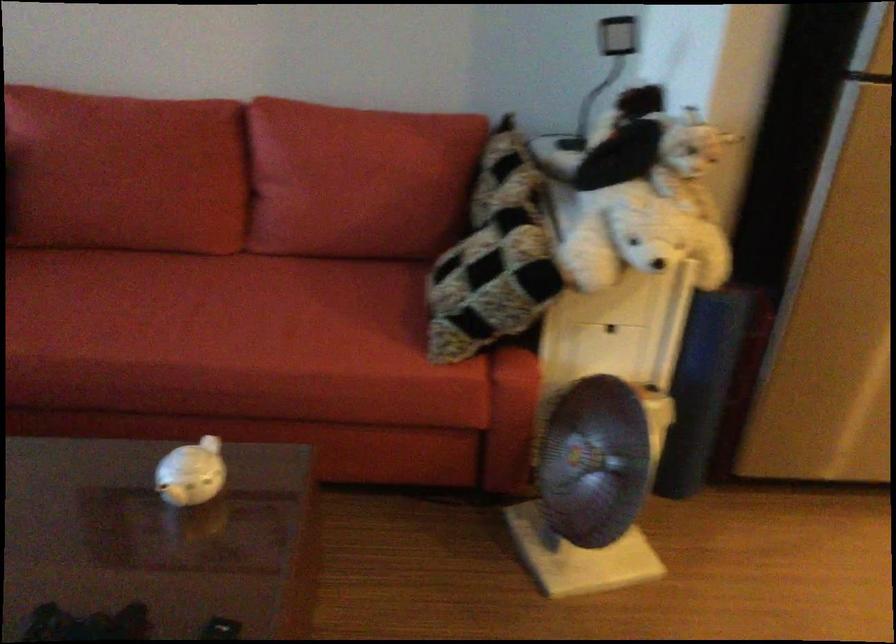
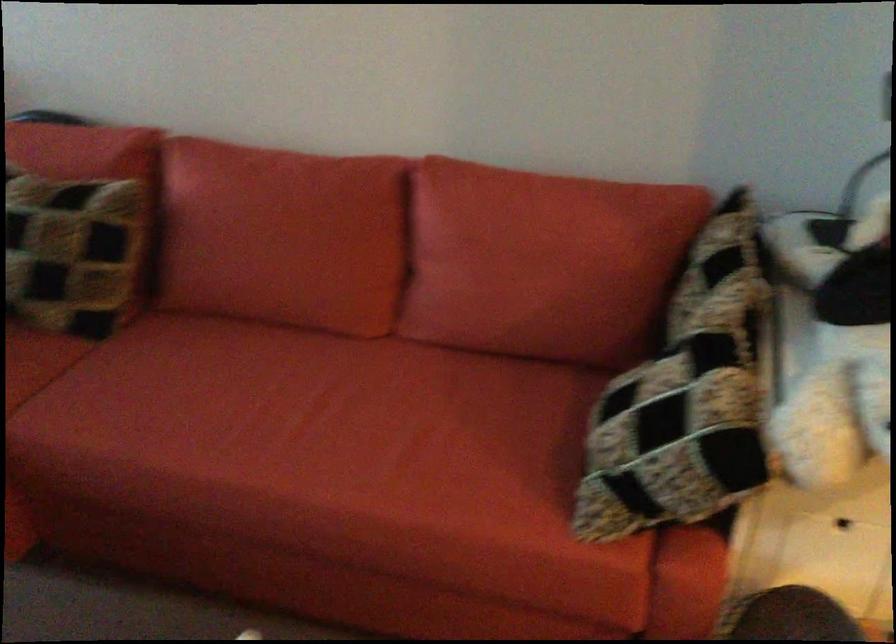
Where in the second image is the point corresponding to (x=558, y=209) from the first image?

(787, 341)